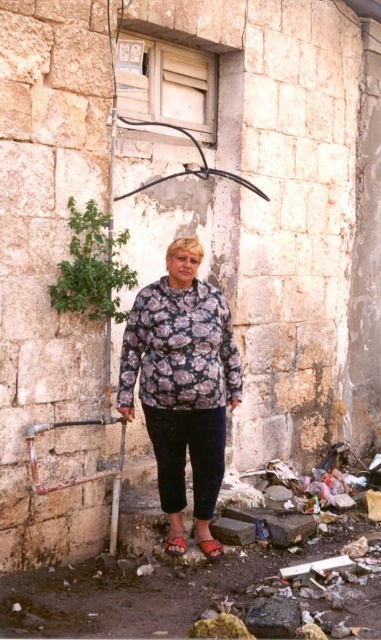
Question: Which of the following is the farthest from the observer?

Choices:
 (A) (184, 541)
 (B) (193, 240)

Answer: (A)

Question: Does floral-patterned fabric at center have a smaller size compared to leather sandal at lower center?

Choices:
 (A) yes
 (B) no

Answer: (B)

Question: Is floral-patterned fabric at center wider than leather sandal at lower center?

Choices:
 (A) yes
 (B) no

Answer: (A)

Question: Does floral-patterned fabric at center have a larger size compared to leather sandal at lower center?

Choices:
 (A) yes
 (B) no

Answer: (A)

Question: Which object appears closest to the camera in this image?

Choices:
 (A) leather sandal at lower center
 (B) floral-patterned fabric at center

Answer: (B)

Question: Which of the following is the closest to the observer?

Choices:
 (A) (134, 337)
 (B) (214, 545)
 (C) (174, 541)

Answer: (A)